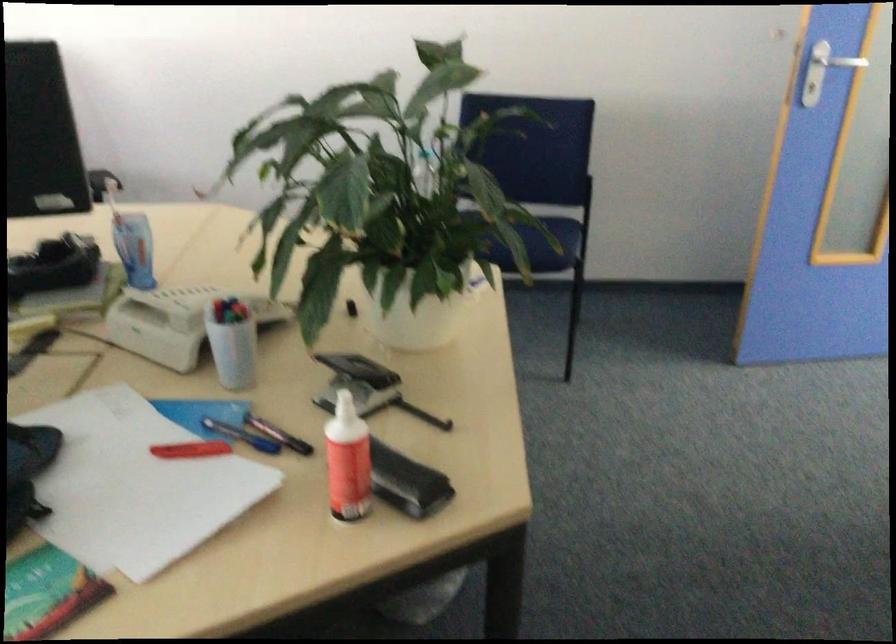
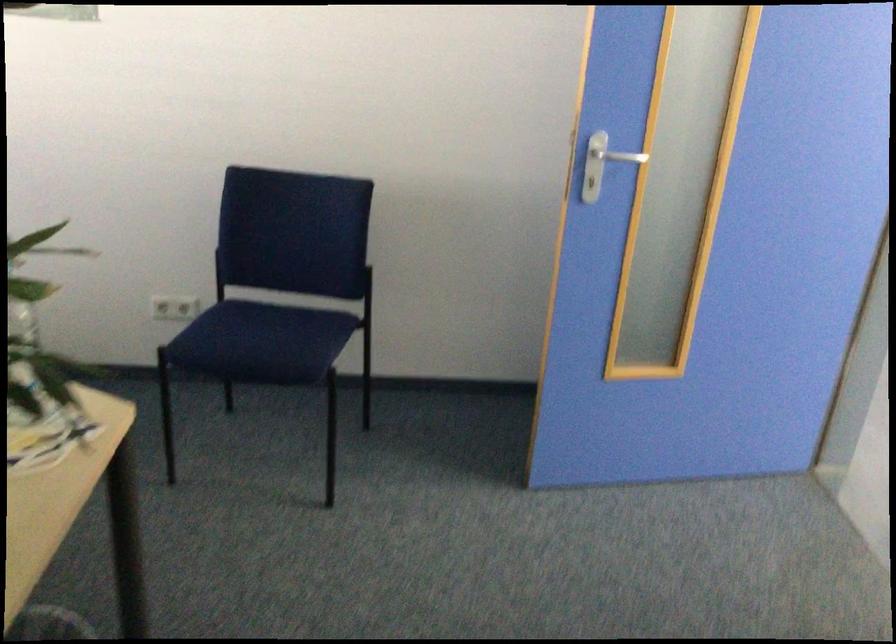
The point at (522, 222) is marked in the first image. Where is the corresponding point in the second image?

(271, 328)